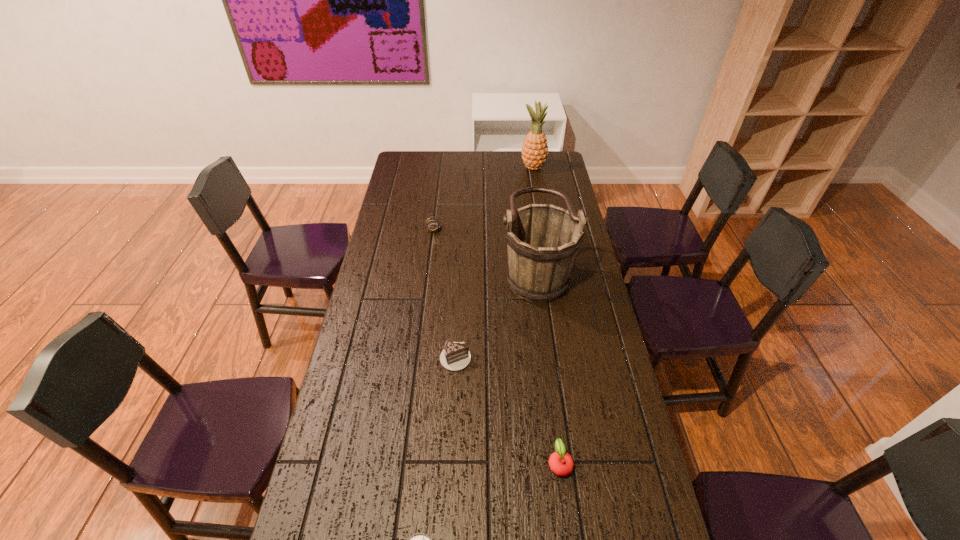
At what (x,y) coordinates should I click in order to perform the action: click on vacant space situated on the handle side of the third farthest object. Please return your answer as a coordinate pair (x, y). The image size is (960, 540). Looking at the image, I should click on (459, 269).

Where is `vacant space located on the handle side of the third farthest object`? Image resolution: width=960 pixels, height=540 pixels. vacant space located on the handle side of the third farthest object is located at coordinates click(x=427, y=269).

You are a GUI agent. You are given a task and a screenshot of the screen. Output one action in this format:
    pyautogui.click(x=<x>, y=<y>)
    Task: Click on the vacant area situated on the face of the fourth shortest object
    
    Given the screenshot: What is the action you would take?
    pyautogui.click(x=429, y=265)

You are a GUI agent. You are given a task and a screenshot of the screen. Output one action in this format:
    pyautogui.click(x=<x>, y=<y>)
    Task: Click on the free spot located on the front of the chocolate cake
    The image size is (960, 540).
    Given the screenshot: What is the action you would take?
    pyautogui.click(x=453, y=401)

The height and width of the screenshot is (540, 960). In order to click on vacant region located on the right of the fifth farthest object in this screenshot , I will do `click(644, 463)`.

Locate an element on the screen. The image size is (960, 540). object that is positioned at the far edge is located at coordinates (534, 152).

Locate an element on the screen. This screenshot has height=540, width=960. pineapple located at the right edge is located at coordinates (534, 152).

This screenshot has height=540, width=960. Identify the location of bucket located at the right edge. (542, 240).

Where is `object that is positioned at the far right corner`? This screenshot has width=960, height=540. object that is positioned at the far right corner is located at coordinates (534, 152).

Locate an element on the screen. free space at the far edge of the desktop is located at coordinates [444, 172].